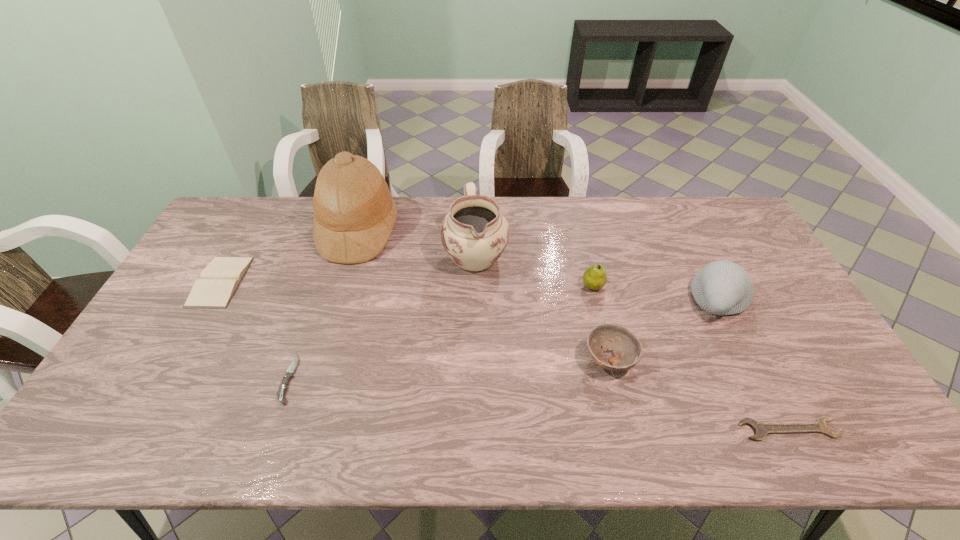
Locate an element on the screen. the nearest object is located at coordinates (760, 429).

Identify the location of vacant region located on the front-facing side of the tallest object. (430, 230).

The width and height of the screenshot is (960, 540). I want to click on vacant space located on the spout of the seventh shortest object, so click(475, 296).

Find the location of `vacant area located 0.120m on the front of the beanie`. vacant area located 0.120m on the front of the beanie is located at coordinates (751, 362).

You are a GUI agent. You are given a task and a screenshot of the screen. Output one action in this format:
    pyautogui.click(x=<x>, y=<y>)
    Task: Click on the vacant space situated on the front of the fifth shortest object
    The height and width of the screenshot is (540, 960).
    Given the screenshot: What is the action you would take?
    pyautogui.click(x=614, y=376)

This screenshot has width=960, height=540. I want to click on vacant point located 0.060m on the left of the fifth tallest object, so click(561, 360).

Locate an element on the screen. free space located on the right of the leftmost object is located at coordinates (294, 281).

You are a GUI agent. You are given a task and a screenshot of the screen. Output one action in this format:
    pyautogui.click(x=<x>, y=<y>)
    Task: Click on the vacant space located 0.170m on the left of the pocketknife
    This screenshot has width=960, height=540.
    Given the screenshot: What is the action you would take?
    pyautogui.click(x=217, y=379)

Locate an element on the screen. vacant space located on the back of the shortest object is located at coordinates (748, 348).

At what (x,y) coordinates should I click in order to perform the action: click on hat at the far edge. Please return your answer as a coordinate pair (x, y). Image resolution: width=960 pixels, height=540 pixels. Looking at the image, I should click on (354, 213).